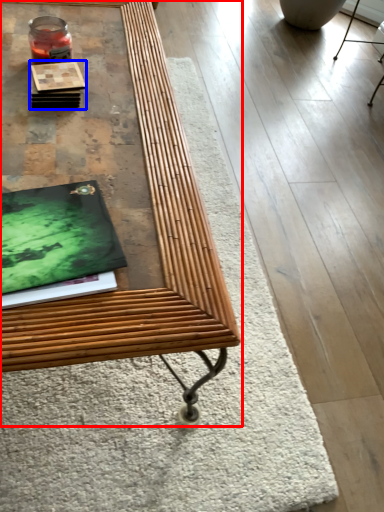
Question: Which object is closer to the camera taking this photo, table (highlighted by a red box) or book (highlighted by a blue box)?

Choices:
 (A) table
 (B) book

Answer: (A)